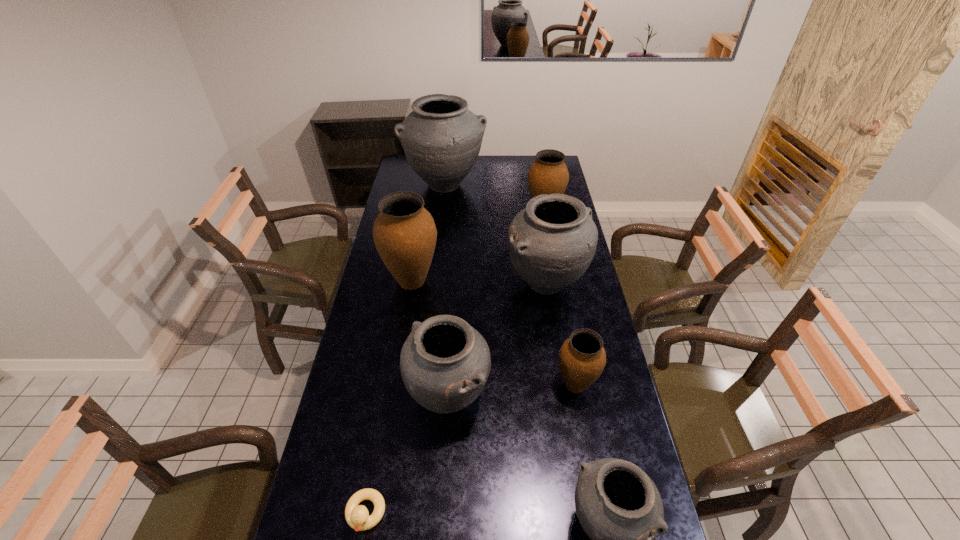
This screenshot has height=540, width=960. I want to click on the biggest black urn, so click(441, 137).

You are a GUI agent. You are given a task and a screenshot of the screen. Output one action in this format:
    pyautogui.click(x=<x>, y=<y>)
    Task: Click on the leftmost brown urn
    
    Given the screenshot: What is the action you would take?
    pyautogui.click(x=404, y=232)

Identify the location of the second farthest brown urn. (404, 232).

Where is `the third smallest black urn`? This screenshot has height=540, width=960. the third smallest black urn is located at coordinates (551, 243).

Where is `the farthest brown urn`? the farthest brown urn is located at coordinates (548, 174).

Where is `the third farthest black urn`? Image resolution: width=960 pixels, height=540 pixels. the third farthest black urn is located at coordinates (445, 363).

Image resolution: width=960 pixels, height=540 pixels. In order to click on the nearest brown urn in this screenshot , I will do `click(582, 358)`.

In order to click on the shortest object in this screenshot , I will do `click(357, 516)`.

Find the location of a particular element. The height and width of the screenshot is (540, 960). free spot located 0.050m on the front of the farthest black urn is located at coordinates (443, 212).

Image resolution: width=960 pixels, height=540 pixels. I want to click on free space located on the right of the leftmost brown urn, so click(531, 281).